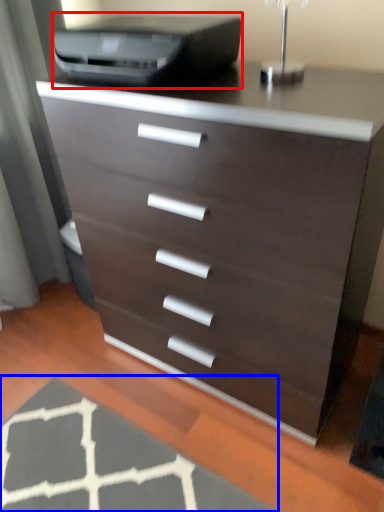
Question: Among these objects, which one is farthest to the camera, printer (highlighted by a red box) or doormat (highlighted by a blue box)?

Choices:
 (A) printer
 (B) doormat

Answer: (A)